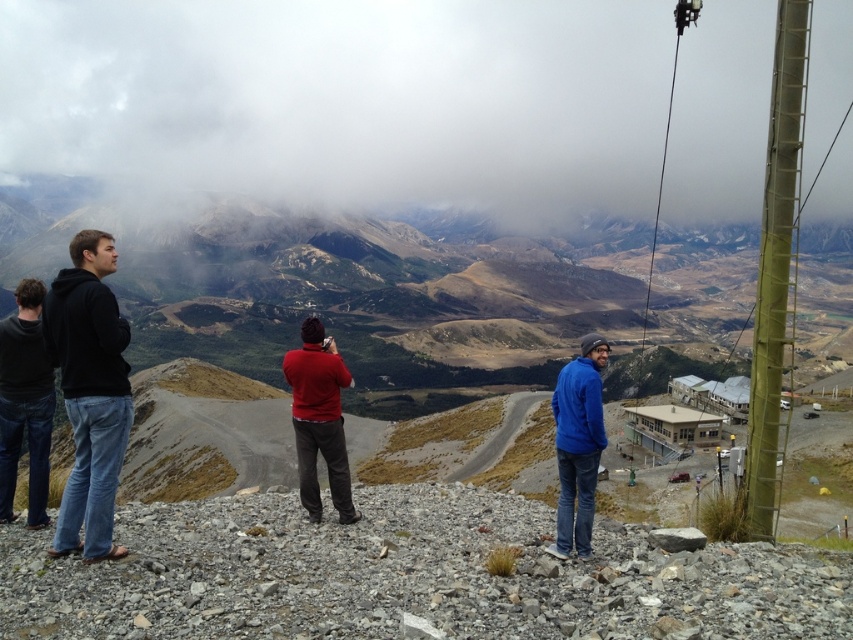
Question: Which object is farther from the camera taking this photo?

Choices:
 (A) blue fleece jacket at center
 (B) dark gray sweater at left

Answer: (A)

Question: Which is farther from the dark gray sweater at left?

Choices:
 (A) brown grassy mountain at center
 (B) smooth gray rock at center
 (C) white fluffy cloud at upper center

Answer: (C)

Question: Is black cotton hoodie at left to the left of dark gray sweater at left from the viewer's perspective?

Choices:
 (A) yes
 (B) no

Answer: (A)

Question: Can you confirm if brown grassy mountain at center is bigger than black cotton hoodie at left?

Choices:
 (A) no
 (B) yes

Answer: (B)

Question: Can you confirm if black cotton hoodie at left is smaller than matte red sweater at center?

Choices:
 (A) yes
 (B) no

Answer: (B)

Question: Which point is closer to the camera?

Choices:
 (A) white fluffy cloud at upper center
 (B) brown grassy mountain at center

Answer: (B)